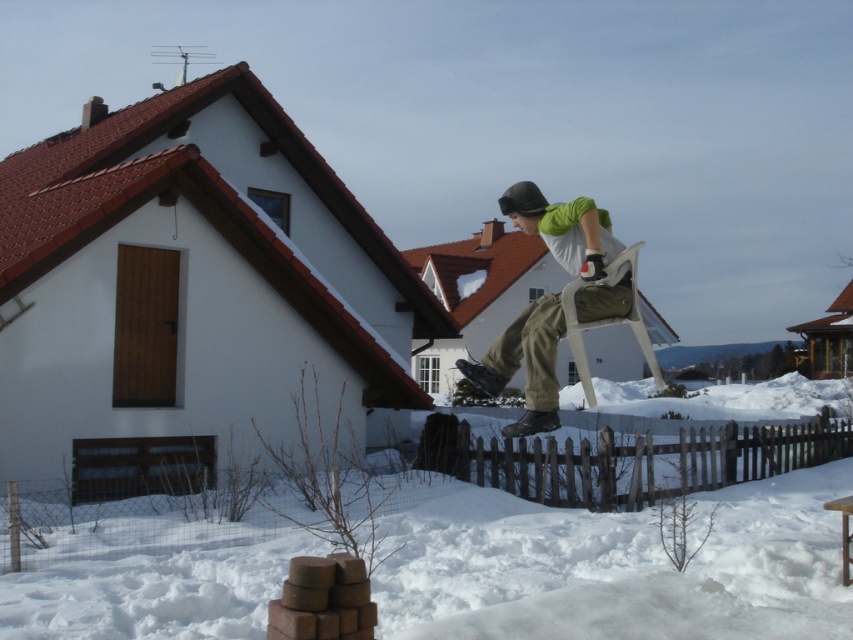
You are a drone operator trying to capture a photo of the brown wooden fence at lower center and the matte green shirt at center. Which object should you focus on first if you want to ensure both are in the frame without moving the camera?

The brown wooden fence at lower center has a lesser width compared to matte green shirt at center, so you should focus on the matte green shirt at center first since it is wider and will require more space in the frame.

You are standing in the snowy backyard and want to walk towards the brown wooden fence at lower center. Which direction should you move relative to the matte green shirt at center?

You should move to the right relative to the matte green shirt at center to reach the brown wooden fence at lower center because the brown wooden fence at lower center is located to the right of the matte green shirt at center.